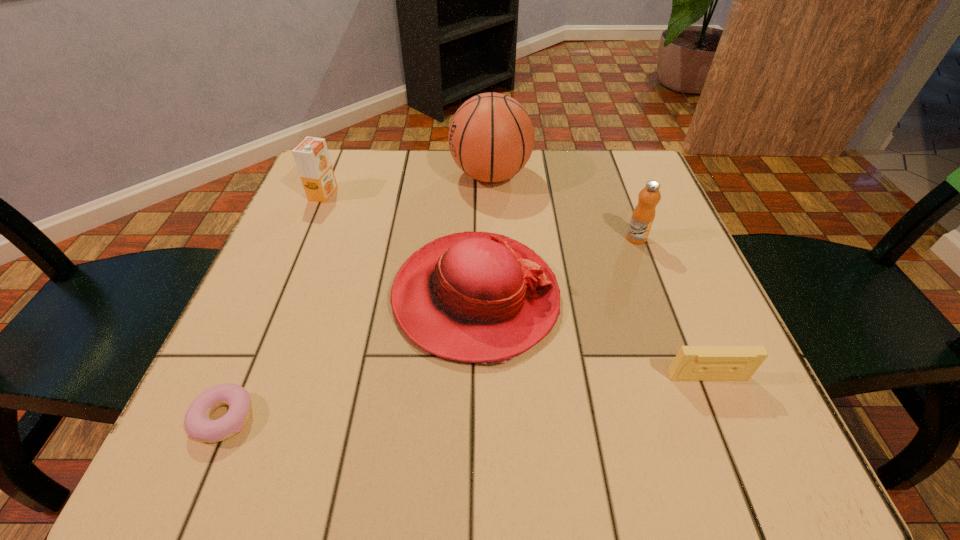
Find the location of a particular element. This screenshot has width=960, height=540. vacant space located 0.100m on the surface of the basketball near the brand logo is located at coordinates (410, 176).

Locate an element on the screen. vacant region located on the back of the left orange juice is located at coordinates (336, 163).

Find the location of `vacant space located 0.150m on the front label of the nearer orange juice`. vacant space located 0.150m on the front label of the nearer orange juice is located at coordinates (660, 300).

Where is `free spot located at the front of the hat with a bow`? The image size is (960, 540). free spot located at the front of the hat with a bow is located at coordinates (684, 298).

You are a GUI agent. You are given a task and a screenshot of the screen. Output one action in this format:
    pyautogui.click(x=<x>, y=<y>)
    Task: Click on the vacant point located at the front of the second nearest object with spools
    This screenshot has height=540, width=960.
    Given the screenshot: What is the action you would take?
    pyautogui.click(x=736, y=446)

At what (x,y) coordinates should I click in order to perform the action: click on free location located 0.250m on the right of the doughnut. Please return your answer as a coordinate pair (x, y). The image size is (960, 540). Looking at the image, I should click on (x=425, y=418).

At what (x,y) coordinates should I click in order to perform the action: click on basketball present at the far edge. Please return your answer as a coordinate pair (x, y). The width and height of the screenshot is (960, 540). Looking at the image, I should click on (491, 137).

You are a GUI agent. You are given a task and a screenshot of the screen. Output one action in this format:
    pyautogui.click(x=<x>, y=<y>)
    Task: Click on the orange juice at the far edge
    This screenshot has height=540, width=960.
    Given the screenshot: What is the action you would take?
    pyautogui.click(x=311, y=155)

Where is `object at the near edge`? This screenshot has width=960, height=540. object at the near edge is located at coordinates (198, 424).

Locate an element on the screen. This screenshot has width=960, height=540. orange juice that is at the left edge is located at coordinates (311, 155).